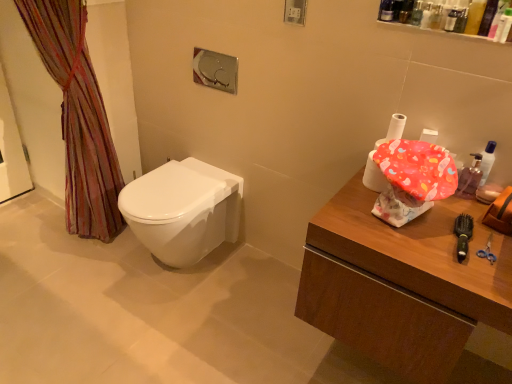
Question: Is green plastic brush at right completely or partially inside translucent plastic bottles at upper right, which is the second toiletry from right to left?

Choices:
 (A) no
 (B) yes

Answer: (A)

Question: Can you confirm if translucent plastic bottles at upper right, which appears as the first toiletry when viewed from the left, is taller than green plastic brush at right?

Choices:
 (A) no
 (B) yes

Answer: (B)

Question: Is translucent plastic bottles at upper right, which is the second toiletry from right to left, not inside green plastic brush at right?

Choices:
 (A) no
 (B) yes

Answer: (B)

Question: Is translucent plastic bottles at upper right, which appears as the first toiletry when viewed from the left, at the left side of green plastic brush at right?

Choices:
 (A) no
 (B) yes

Answer: (B)

Question: Is translucent plastic bottles at upper right, which appears as the first toiletry when viewed from the left, positioned behind green plastic brush at right?

Choices:
 (A) yes
 (B) no

Answer: (A)

Question: From the image's perspective, does translucent plastic bottles at upper right, which is the second toiletry from right to left, appear lower than green plastic brush at right?

Choices:
 (A) yes
 (B) no

Answer: (B)

Question: Does translucent plastic bottles at upper right, which appears as the first toiletry when viewed from the left, have a greater height compared to translucent plastic container at upper right, which is the 1th toiletry from right to left?

Choices:
 (A) no
 (B) yes

Answer: (A)

Question: Is translucent plastic container at upper right, which is the 1th toiletry from right to left, surrounded by translucent plastic bottles at upper right, which appears as the first toiletry when viewed from the left?

Choices:
 (A) yes
 (B) no

Answer: (B)

Question: Does translucent plastic bottles at upper right, which appears as the first toiletry when viewed from the left, have a larger size compared to translucent plastic container at upper right, which is the 1th toiletry from right to left?

Choices:
 (A) yes
 (B) no

Answer: (B)

Question: Could you tell me if translucent plastic bottles at upper right, which appears as the first toiletry when viewed from the left, is facing translucent plastic container at upper right, which ranks as the 2th toiletry in left-to-right order?

Choices:
 (A) no
 (B) yes

Answer: (A)

Question: From a real-world perspective, does translucent plastic bottles at upper right, which is the second toiletry from right to left, stand above translucent plastic container at upper right, which ranks as the 2th toiletry in left-to-right order?

Choices:
 (A) yes
 (B) no

Answer: (B)

Question: Can you confirm if translucent plastic bottles at upper right, which is the second toiletry from right to left, is wider than translucent plastic container at upper right, which ranks as the 2th toiletry in left-to-right order?

Choices:
 (A) yes
 (B) no

Answer: (A)

Question: Is white glossy toilet at center thinner than green plastic brush at right?

Choices:
 (A) no
 (B) yes

Answer: (A)